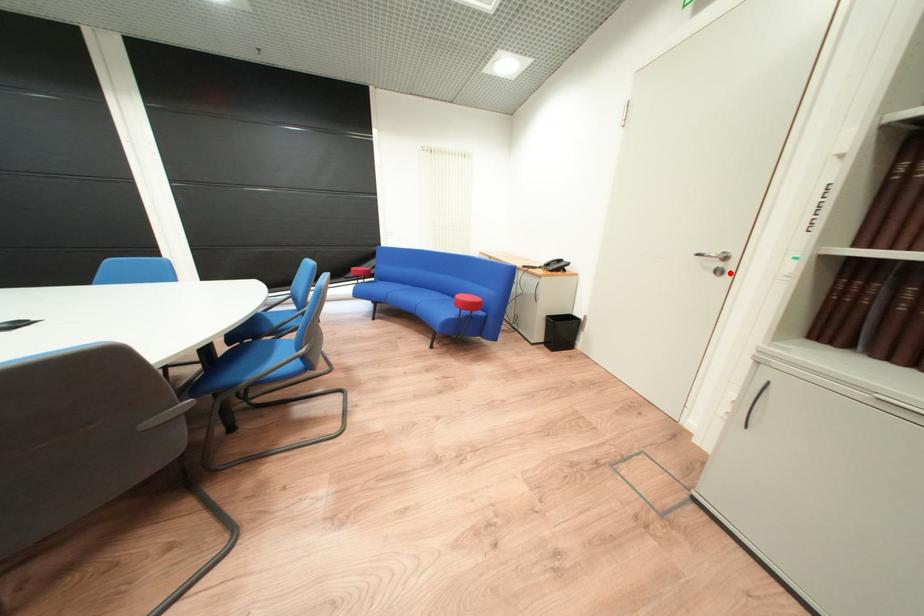
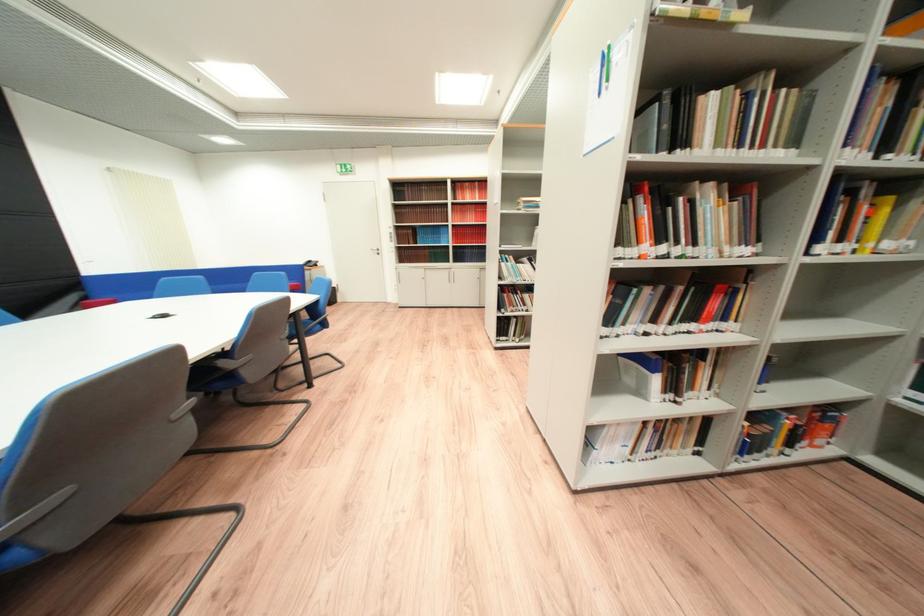
Find the pixel in the second image that matches the highlighted location in the first image.

(388, 254)